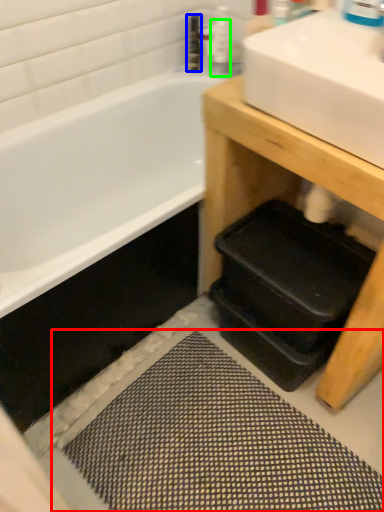
Question: Considering the real-world distances, which object is closest to bath mat (highlighted by a red box)? toiletry (highlighted by a blue box) or toiletry (highlighted by a green box).

Choices:
 (A) toiletry
 (B) toiletry

Answer: (B)